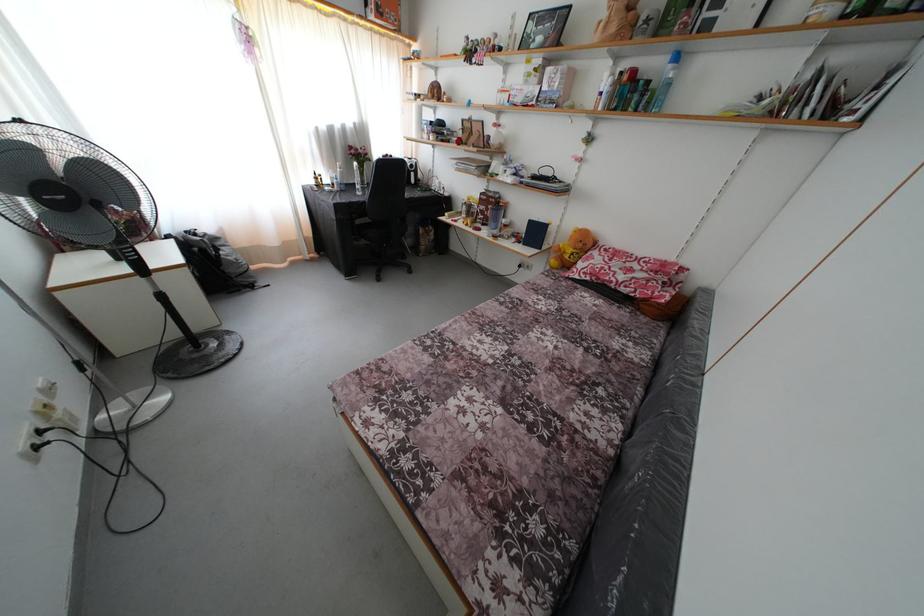
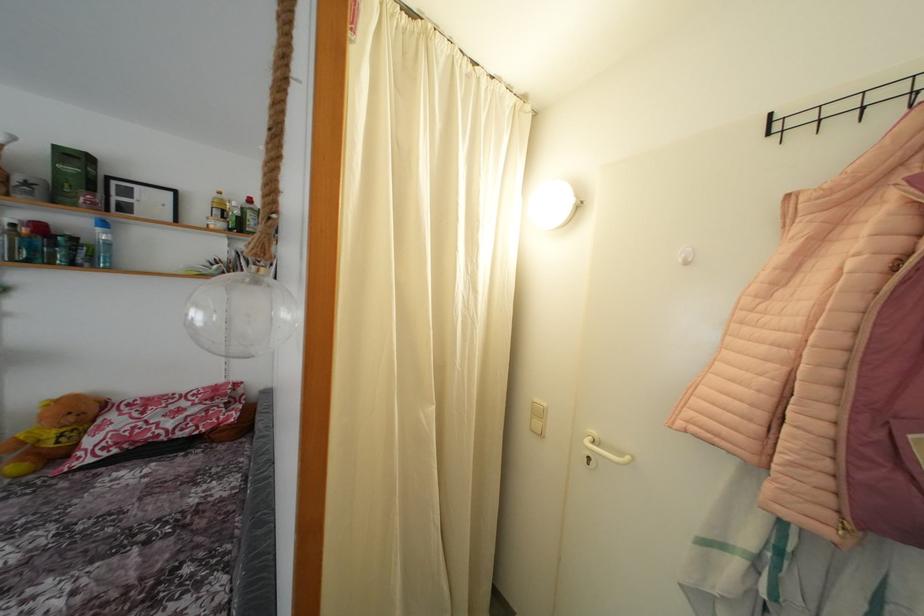
Find the pixel in the second image that matches point 868,126 in the first image.

(281, 286)